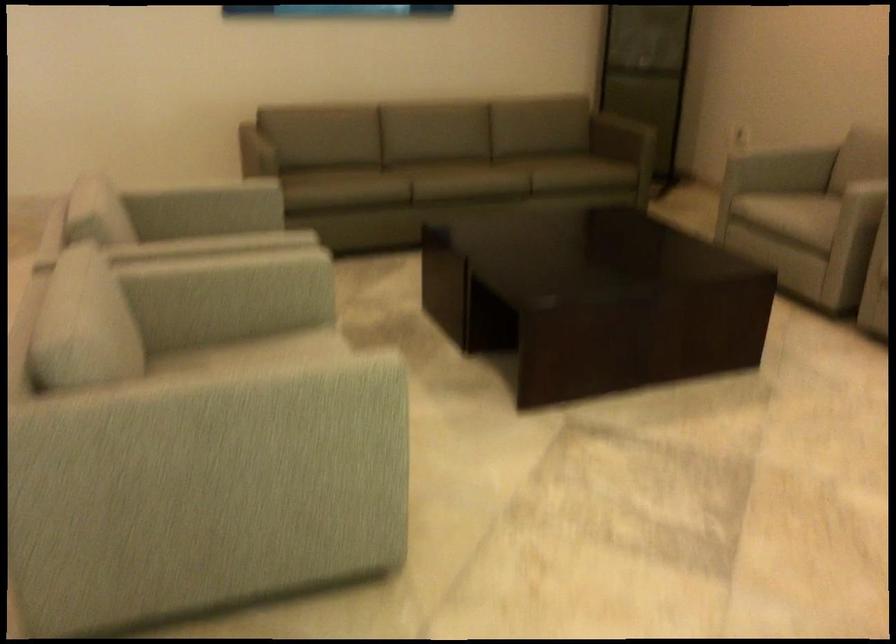
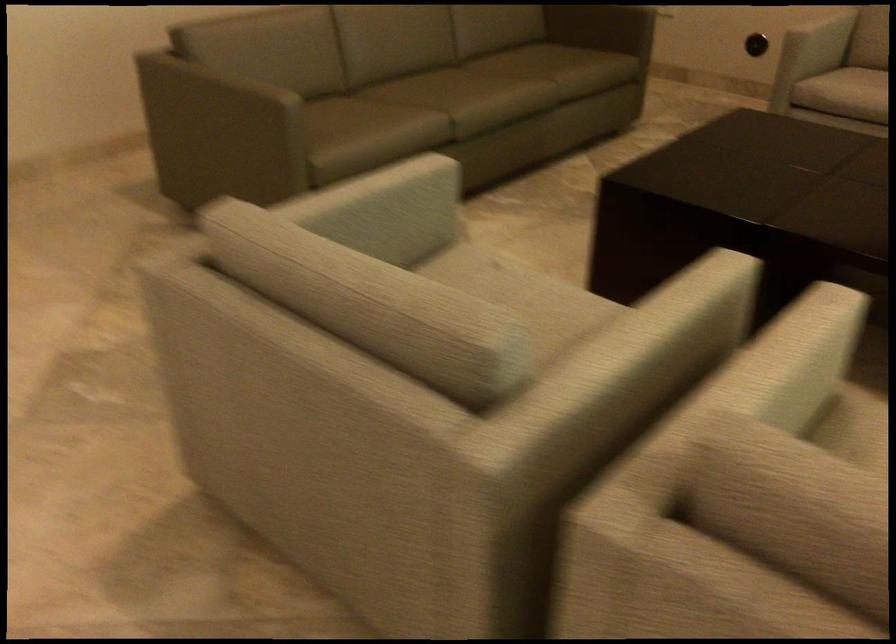
In the second image, find the point that corresponds to the point at 181,249 in the first image.

(659, 332)